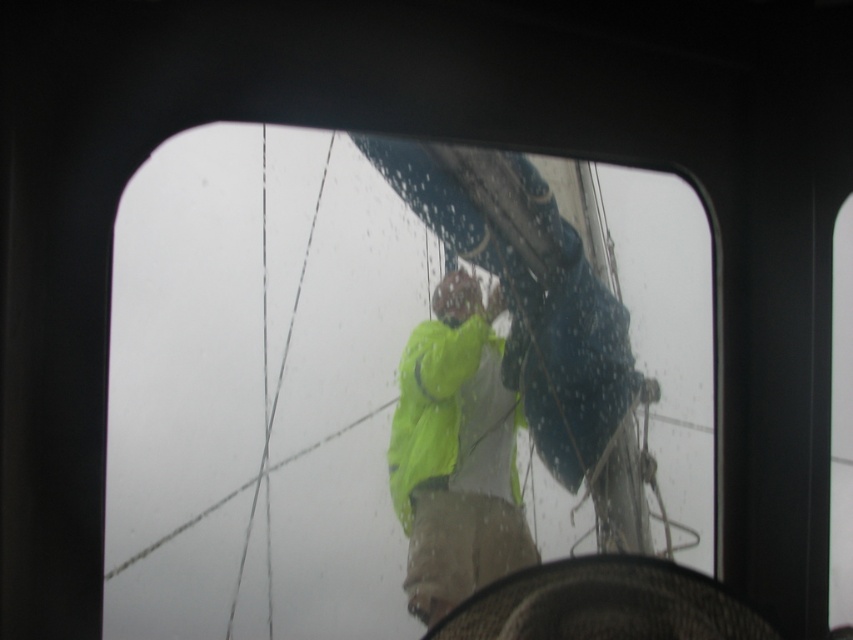
You are a sailor on a ship and need to reach the transparent glass sailboat at center from your current position. The neon yellow raincoat at center is blocking your path. Can you safely navigate around it without getting too close?

The transparent glass sailboat at center is 17.85 centimeters away from the neon yellow raincoat at center. Since the distance is sufficient, you can safely navigate around the neon yellow raincoat at center to reach the transparent glass sailboat at center without getting too close.

You are on a boat and want to know if the transparent glass sailboat at center can be seen through the window while the neon yellow raincoat at center is in the way. Can you see the sailboat through the raincoat?

The transparent glass sailboat at center is bigger than neon yellow raincoat at center, so yes, the sailboat can be seen through the window even if the raincoat is in the way because the sailboat is larger and occupies more of the view.